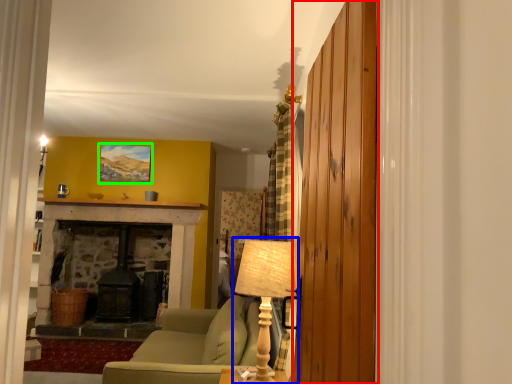
Question: Estimate the real-world distances between objects in this image. Which object is closer to barn door (highlighted by a red box), table lamp (highlighted by a blue box) or picture frame (highlighted by a green box)?

Choices:
 (A) table lamp
 (B) picture frame

Answer: (A)